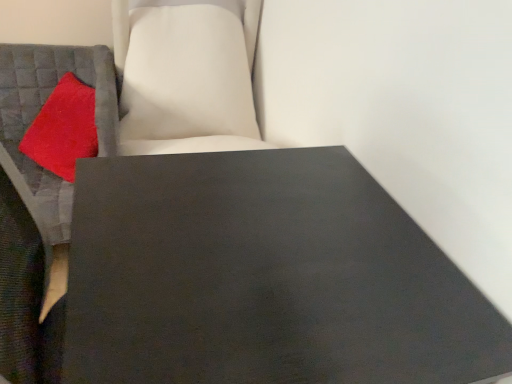
Question: Does velvety red pillow at left have a greater width compared to matte black table at center?

Choices:
 (A) no
 (B) yes

Answer: (A)

Question: Can you confirm if velvety red pillow at left is shorter than matte black table at center?

Choices:
 (A) yes
 (B) no

Answer: (A)

Question: From a real-world perspective, is velvety red pillow at left on matte black table at center?

Choices:
 (A) yes
 (B) no

Answer: (A)

Question: From a real-world perspective, is velvety red pillow at left under matte black table at center?

Choices:
 (A) no
 (B) yes

Answer: (A)

Question: Is velvety red pillow at left outside of matte black table at center?

Choices:
 (A) no
 (B) yes

Answer: (B)

Question: Considering their positions, is velvety red pillow at left located in front of or behind matte gray cushion at left?

Choices:
 (A) behind
 (B) front

Answer: (A)

Question: Visually, is velvety red pillow at left positioned to the left or to the right of matte gray cushion at left?

Choices:
 (A) right
 (B) left

Answer: (A)

Question: Is velvety red pillow at left spatially inside matte gray cushion at left, or outside of it?

Choices:
 (A) outside
 (B) inside

Answer: (B)

Question: Looking at their shapes, would you say velvety red pillow at left is wider or thinner than matte gray cushion at left?

Choices:
 (A) wide
 (B) thin

Answer: (B)

Question: Does point (44, 312) appear closer or farther from the camera than point (69, 107)?

Choices:
 (A) closer
 (B) farther

Answer: (A)

Question: From a real-world perspective, relative to velvety red pillow at left, is matte gray cushion at left vertically above or below?

Choices:
 (A) above
 (B) below

Answer: (B)

Question: Is matte gray cushion at left taller or shorter than velvety red pillow at left?

Choices:
 (A) short
 (B) tall

Answer: (B)

Question: In the image, is matte gray cushion at left on the left side or the right side of velvety red pillow at left?

Choices:
 (A) left
 (B) right

Answer: (A)

Question: Is matte gray cushion at left to the left or to the right of matte black table at center in the image?

Choices:
 (A) right
 (B) left

Answer: (B)

Question: Which is correct: matte gray cushion at left is inside matte black table at center, or outside of it?

Choices:
 (A) inside
 (B) outside

Answer: (B)